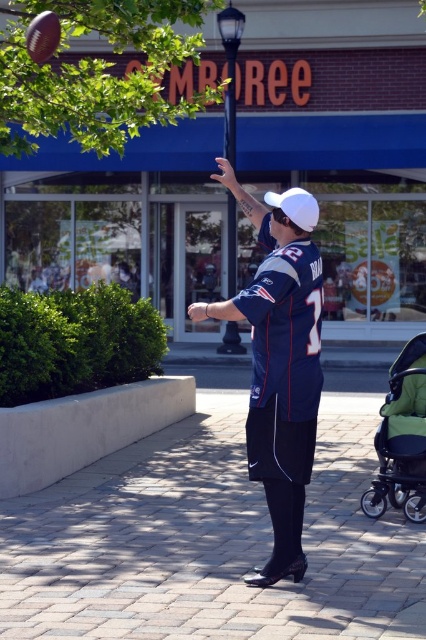
Question: Can you confirm if green fabric stroller at lower right is smaller than white matte baseball cap at center?

Choices:
 (A) yes
 (B) no

Answer: (B)

Question: Can you confirm if blue jersey at center is smaller than white matte baseball cap at center?

Choices:
 (A) no
 (B) yes

Answer: (A)

Question: Which of the following is the farthest from the observer?

Choices:
 (A) white matte baseball cap at center
 (B) blue jersey at center

Answer: (A)

Question: Among these objects, which one is nearest to the camera?

Choices:
 (A) blue jersey at center
 (B) green fabric stroller at lower right

Answer: (A)

Question: Is green fabric stroller at lower right further to camera compared to white matte baseball cap at center?

Choices:
 (A) yes
 (B) no

Answer: (A)

Question: Which object appears closest to the camera in this image?

Choices:
 (A) white matte baseball cap at center
 (B) green fabric stroller at lower right
 (C) blue jersey at center

Answer: (C)